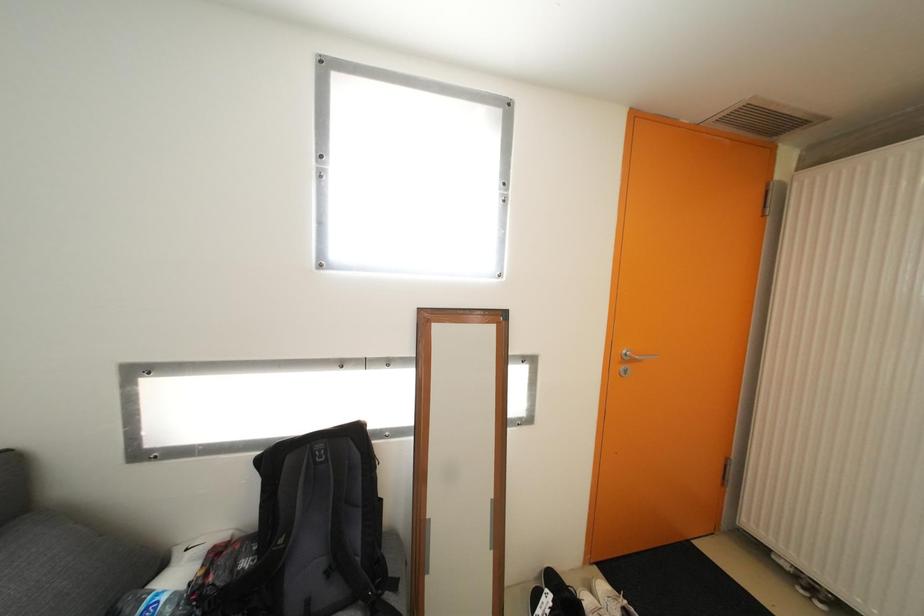
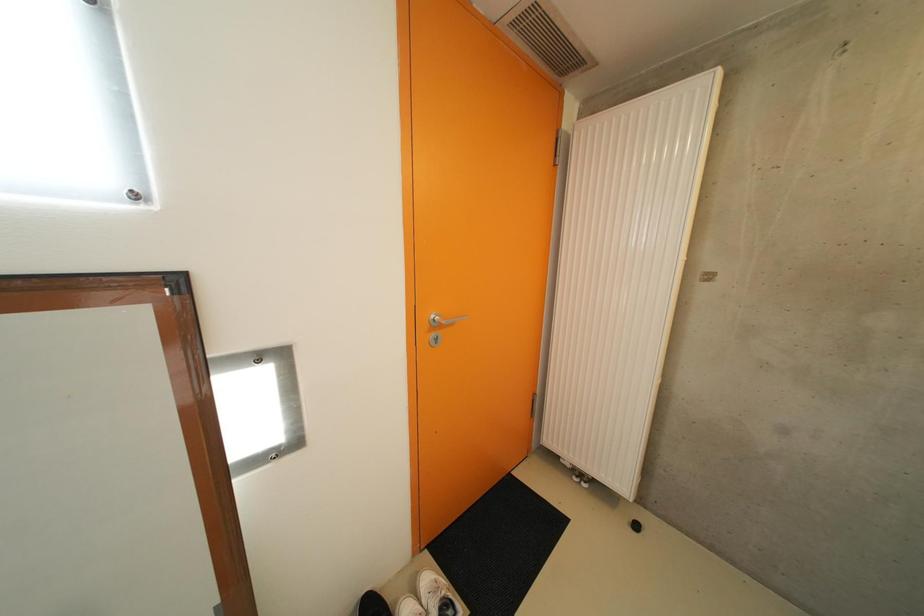
Question: The images are taken continuously from a first-person perspective. In which direction is your viewpoint rotating?

Choices:
 (A) Left
 (B) Right
 (C) Up
 (D) Down

Answer: (B)